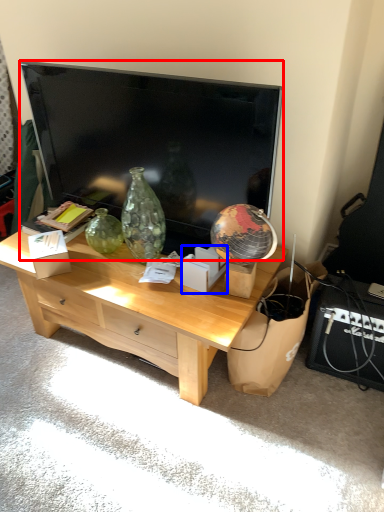
Question: Which object is further to the camera taking this photo, television (highlighted by a red box) or cardboard box (highlighted by a blue box)?

Choices:
 (A) television
 (B) cardboard box

Answer: (B)